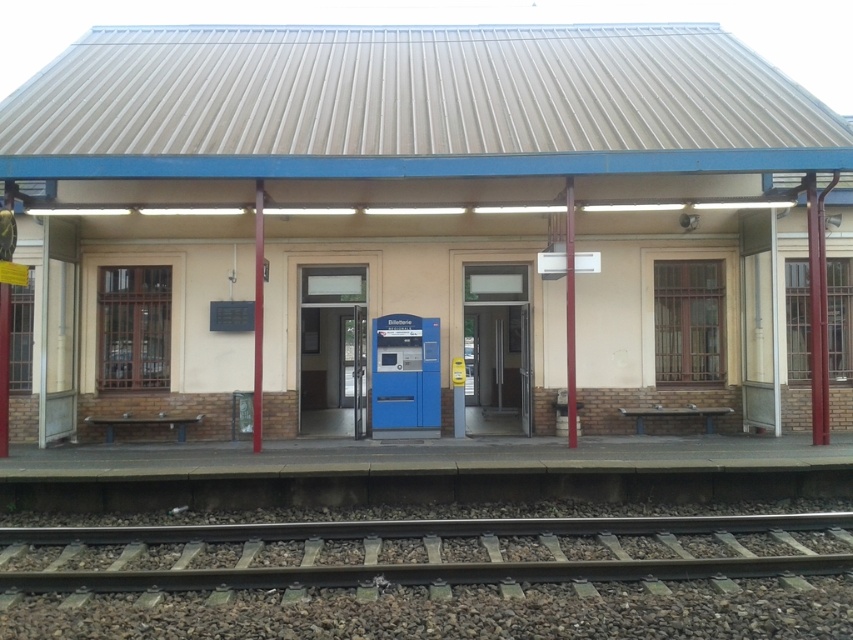
Is beige concrete shed at center closer to camera compared to gray gravel train track at lower center?

No.

Is beige concrete shed at center to the right of gray gravel train track at lower center from the viewer's perspective?

Correct, you'll find beige concrete shed at center to the right of gray gravel train track at lower center.

Which is in front, point (194, 42) or point (705, 516)?

Point (705, 516)

Find the location of a particular element. beige concrete shed at center is located at coordinates 428,221.